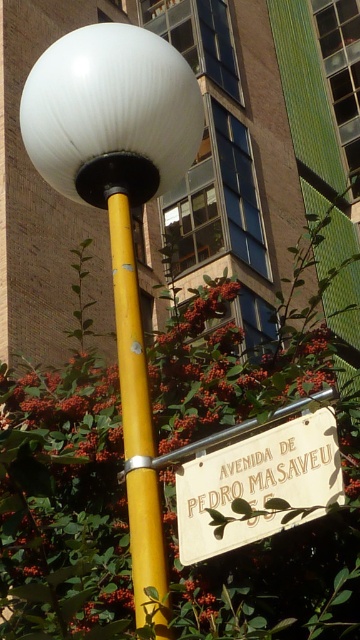
Based on the photo, is white glossy street light at upper left positioned behind wooden sign at lower center?

Yes, white glossy street light at upper left is behind wooden sign at lower center.

Between white glossy street light at upper left and wooden sign at lower center, which one appears on the left side from the viewer's perspective?

white glossy street light at upper left

Is point (129, 300) positioned behind point (239, 445)?

Yes, point (129, 300) is behind point (239, 445).

The width and height of the screenshot is (360, 640). In order to click on white glossy street light at upper left in this screenshot , I will do `click(119, 212)`.

Can you confirm if wooden sign at lower center is thinner than yellow matte pole at center?

No, wooden sign at lower center is not thinner than yellow matte pole at center.

What do you see at coordinates (258, 484) in the screenshot? Image resolution: width=360 pixels, height=640 pixels. I see `wooden sign at lower center` at bounding box center [258, 484].

Is point (239, 486) positioned after point (155, 490)?

That is False.

I want to click on wooden sign at lower center, so click(x=258, y=484).

Which of these two, white glossy sphere at upper left or wooden sign at lower center, stands taller?

white glossy sphere at upper left is taller.

Based on the photo, is white glossy sphere at upper left smaller than wooden sign at lower center?

No, white glossy sphere at upper left is not smaller than wooden sign at lower center.

Between point (66, 38) and point (217, 452), which one is positioned behind?

Positioned behind is point (66, 38).

I want to click on white glossy sphere at upper left, so click(110, 115).